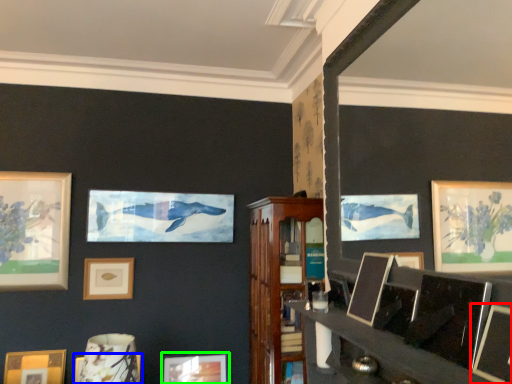
Question: Which object is the farthest from picture frame (highlighted by a red box)? Choose among these: picture frame (highlighted by a blue box) or picture frame (highlighted by a green box).

Choices:
 (A) picture frame
 (B) picture frame

Answer: (B)